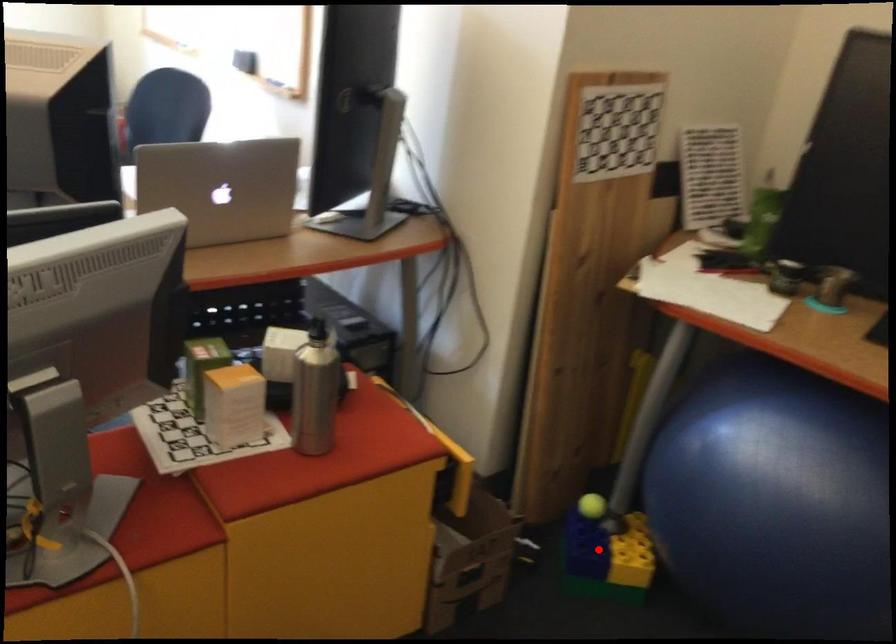
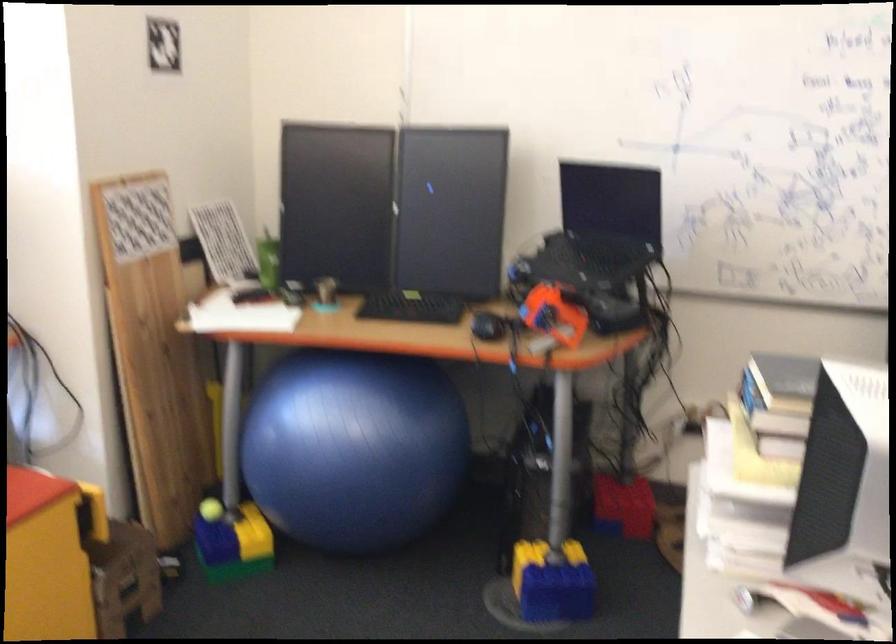
Question: A red point is marked in image1. In image2, is the corresponding 3D point closer to the camera or farther? Reply with the corresponding letter.

Choices:
 (A) The corresponding 3D point is closer.
 (B) The corresponding 3D point is farther.

Answer: (B)